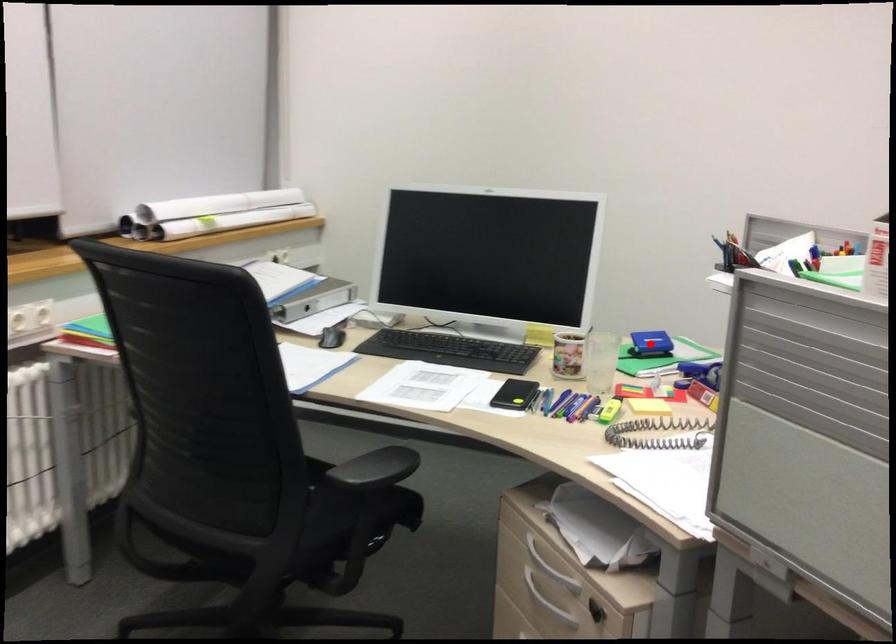
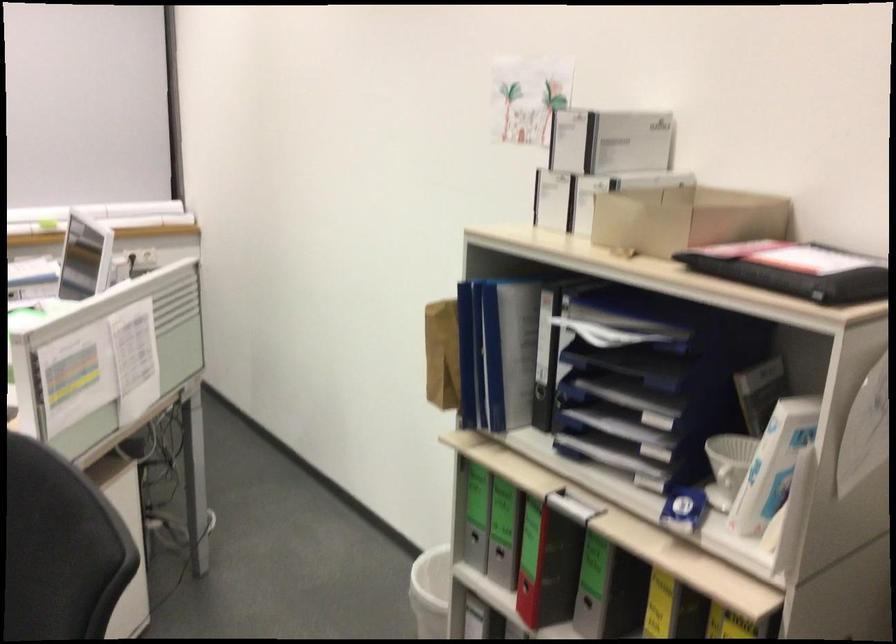
Question: I am providing you with two images of the same scene from different viewpoints. A red point is marked on the first image. Is the red point's position out of view in image 2?

Choices:
 (A) Yes
 (B) No

Answer: (A)